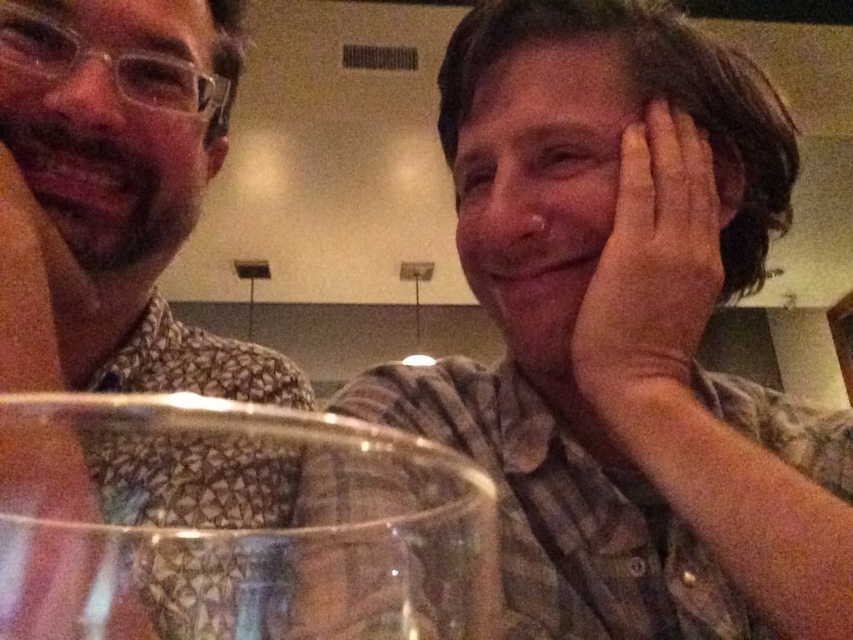
Question: Which of the following is the closest to the observer?

Choices:
 (A) (241, 45)
 (B) (573, 336)

Answer: (B)

Question: Can you confirm if patterned shirt at left is positioned below pink skin at right?

Choices:
 (A) no
 (B) yes

Answer: (B)

Question: Does patterned shirt at left appear over pink skin at right?

Choices:
 (A) yes
 (B) no

Answer: (B)

Question: Which of the following is the farthest from the observer?

Choices:
 (A) (10, 168)
 (B) (625, 376)

Answer: (A)

Question: Which of the following is the closest to the observer?

Choices:
 (A) patterned shirt at left
 (B) pink skin at right

Answer: (A)

Question: Does patterned shirt at left lie behind pink skin at right?

Choices:
 (A) no
 (B) yes

Answer: (A)